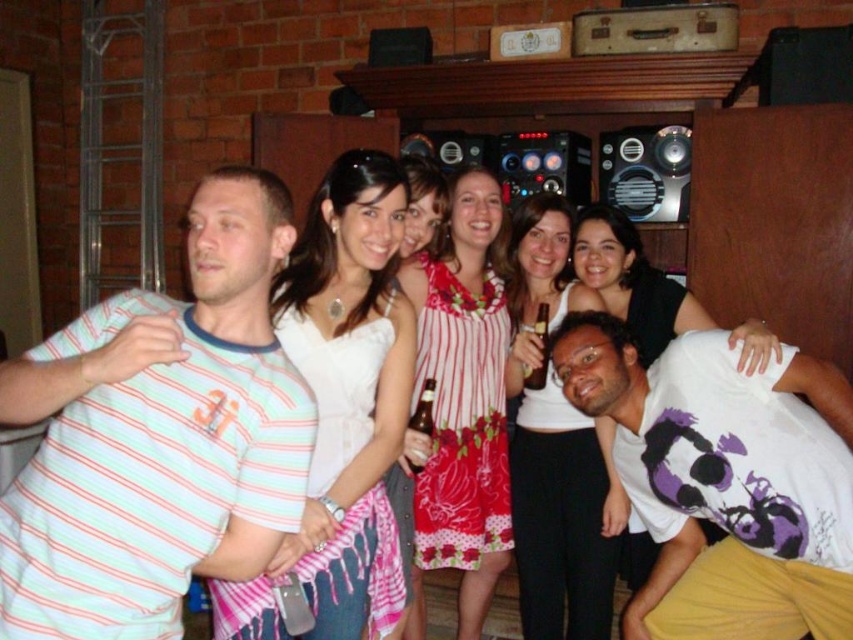
Question: Can you confirm if striped cotton shirt at left is positioned above metallic silver speaker at upper center?

Choices:
 (A) no
 (B) yes

Answer: (A)

Question: Estimate the real-world distances between objects in this image. Which object is farther from the metallic silver speaker at upper center?

Choices:
 (A) white lace dress at center
 (B) striped cotton dress at center

Answer: (A)

Question: Can you confirm if white matte t-shirt at center is positioned to the left of metallic silver speaker at upper center?

Choices:
 (A) no
 (B) yes

Answer: (B)

Question: Among these points, which one is nearest to the camera?

Choices:
 (A) (270, 589)
 (B) (549, 497)

Answer: (A)

Question: Does striped cotton shirt at left appear under white satin dress at center?

Choices:
 (A) no
 (B) yes

Answer: (A)

Question: Among these objects, which one is farthest from the camera?

Choices:
 (A) white matte t-shirt at center
 (B) white lace dress at center

Answer: (B)